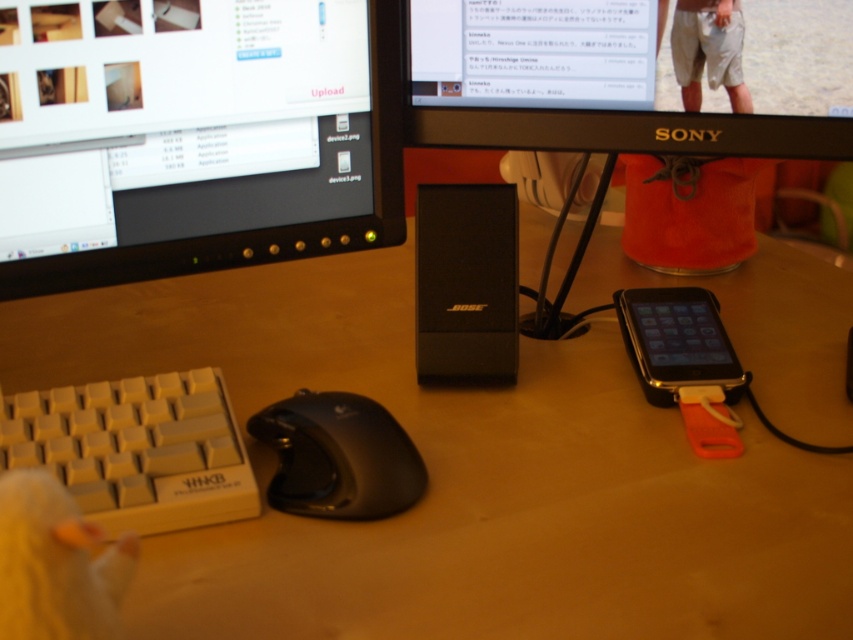
You are organizing your desk and want to move the white plastic keyboard at lower left closer to the black glossy smartphone at lower right. Based on their current positions, which direction should you move the keyboard to get it closer to the smartphone?

The white plastic keyboard at lower left is positioned under the black glossy smartphone at lower right. To move it closer, you should move the keyboard upward towards the smartphone.

You are setting up a new desk and want to place a new object between the black plastic monitor at upper center and the black plastic speaker at center. Considering their sizes, which object should be placed on the left side to ensure there is enough space?

The black plastic monitor at upper center has a larger width than the black plastic speaker at center. Therefore, placing the larger monitor on the left side would allow more space for the smaller speaker on the right.

You are organizing your desk and want to place a new item between the wooden at center and the black plastic speaker at center. Can you place it directly in between them?

The wooden at center is positioned under the black plastic speaker at center, so there is no space between them. You cannot place an item directly in between them.